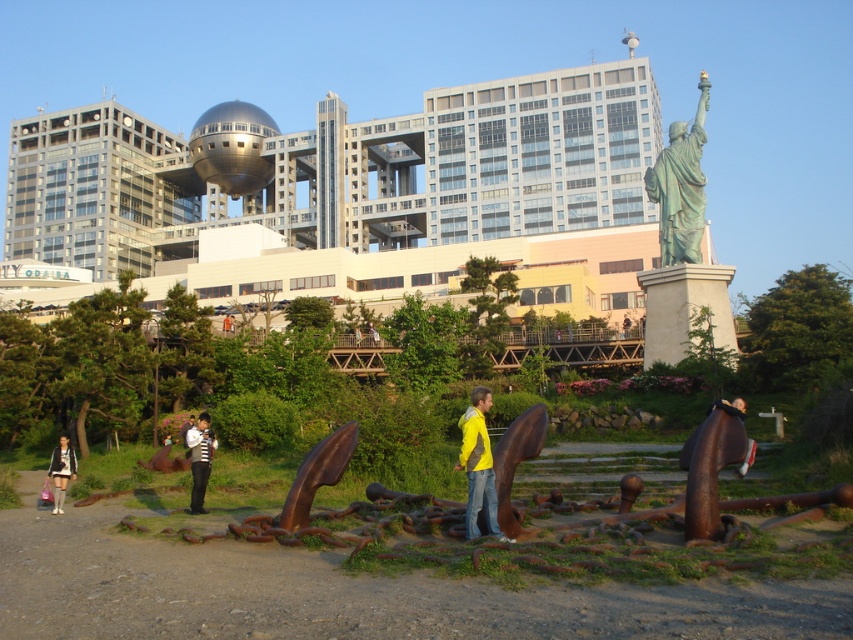
Question: Does white striped shirt at center appear on the right side of matte black dress at lower left?

Choices:
 (A) no
 (B) yes

Answer: (B)

Question: Which object is farther from the camera taking this photo?

Choices:
 (A) yellow matte jacket at center
 (B) green patina statue at upper right
 (C) rusty metal anchor at lower right
 (D) matte black dress at lower left

Answer: (B)

Question: Is rusty metal anchor at lower right bigger than white striped shirt at center?

Choices:
 (A) yes
 (B) no

Answer: (A)

Question: Which of the following is the farthest from the observer?

Choices:
 (A) coord(62,480)
 (B) coord(471,536)
 (C) coord(695,445)

Answer: (A)

Question: Does green patina statue at upper right lie behind yellow matte jacket at center?

Choices:
 (A) no
 (B) yes

Answer: (B)

Question: Which of the following is the farthest from the observer?

Choices:
 (A) yellow matte jacket at center
 (B) green patina statue at upper right

Answer: (B)